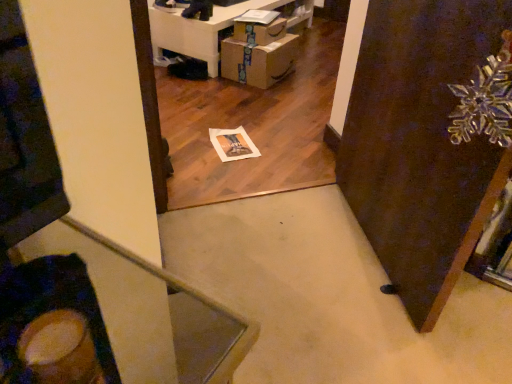
Question: Is transparent glass snowflake at upper right outside of cardboard boxes at lower center?

Choices:
 (A) no
 (B) yes

Answer: (B)

Question: Does transparent glass snowflake at upper right appear on the right side of cardboard boxes at lower center?

Choices:
 (A) no
 (B) yes

Answer: (B)

Question: Is transparent glass snowflake at upper right taller than cardboard boxes at lower center?

Choices:
 (A) yes
 (B) no

Answer: (A)

Question: Considering the relative sizes of transparent glass snowflake at upper right and cardboard boxes at lower center in the image provided, is transparent glass snowflake at upper right bigger than cardboard boxes at lower center?

Choices:
 (A) no
 (B) yes

Answer: (A)

Question: From the image's perspective, is transparent glass snowflake at upper right over cardboard boxes at lower center?

Choices:
 (A) yes
 (B) no

Answer: (B)

Question: Looking at their shapes, would you say metallic gold swivel chair at lower left is wider or thinner than cardboard boxes at lower center?

Choices:
 (A) wide
 (B) thin

Answer: (B)

Question: Considering the positions of point (94, 329) and point (197, 56), is point (94, 329) closer or farther from the camera than point (197, 56)?

Choices:
 (A) closer
 (B) farther

Answer: (A)

Question: In terms of size, does metallic gold swivel chair at lower left appear bigger or smaller than cardboard boxes at lower center?

Choices:
 (A) small
 (B) big

Answer: (A)

Question: Is metallic gold swivel chair at lower left in front of or behind cardboard boxes at lower center in the image?

Choices:
 (A) behind
 (B) front

Answer: (B)

Question: Is cardboard boxes at lower center taller or shorter than transparent glass snowflake at upper right?

Choices:
 (A) tall
 (B) short

Answer: (B)

Question: Considering the relative positions of cardboard boxes at lower center and transparent glass snowflake at upper right in the image provided, is cardboard boxes at lower center to the left or to the right of transparent glass snowflake at upper right?

Choices:
 (A) left
 (B) right

Answer: (A)

Question: Looking at their shapes, would you say cardboard boxes at lower center is wider or thinner than transparent glass snowflake at upper right?

Choices:
 (A) thin
 (B) wide

Answer: (B)

Question: From a real-world perspective, is cardboard boxes at lower center positioned above or below transparent glass snowflake at upper right?

Choices:
 (A) below
 (B) above

Answer: (A)

Question: Is cardboard boxes at lower center bigger or smaller than brown cardboard drawer at center?

Choices:
 (A) big
 (B) small

Answer: (A)

Question: Considering the positions of cardboard boxes at lower center and brown cardboard drawer at center in the image, is cardboard boxes at lower center wider or thinner than brown cardboard drawer at center?

Choices:
 (A) thin
 (B) wide

Answer: (B)